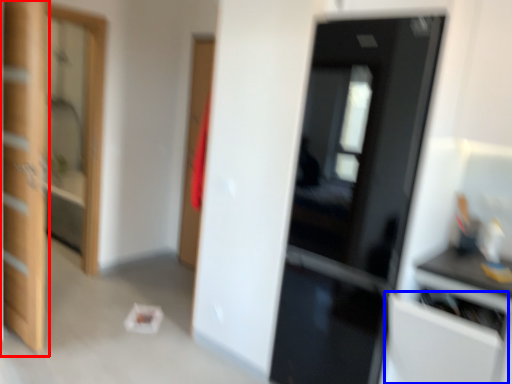
Question: Which object appears farthest to the camera in this image, door (highlighted by a red box) or cabinetry (highlighted by a blue box)?

Choices:
 (A) door
 (B) cabinetry

Answer: (A)